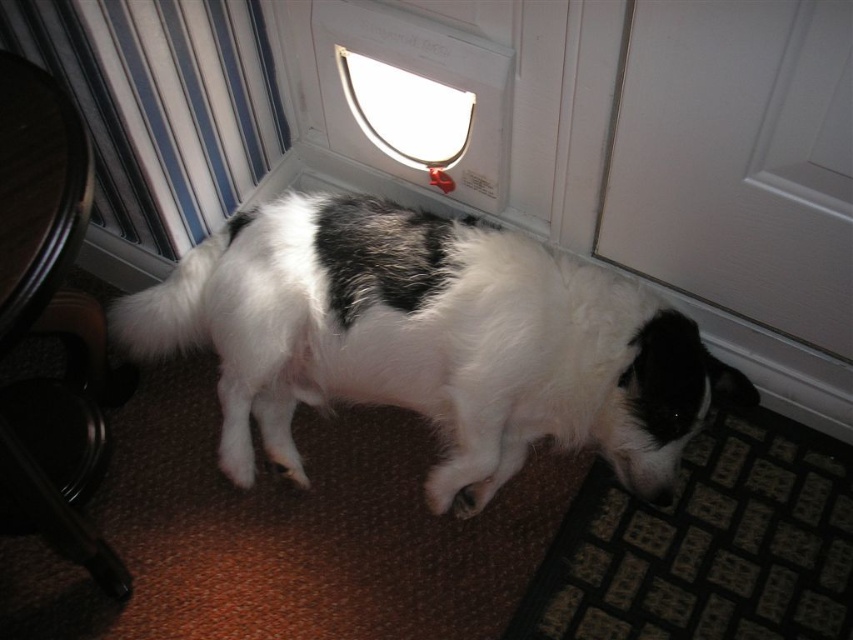
Which is above, white fluffy dog at center or transparent plastic pet door at upper center?

transparent plastic pet door at upper center is higher up.

The width and height of the screenshot is (853, 640). Describe the element at coordinates (428, 340) in the screenshot. I see `white fluffy dog at center` at that location.

Where is `white fluffy dog at center`? The width and height of the screenshot is (853, 640). white fluffy dog at center is located at coordinates (428, 340).

Who is taller, white fluffy dog at center or white matte door at lower right?

white fluffy dog at center

Based on the photo, who is more forward, [630,412] or [705,195]?

Point [705,195] is more forward.

Identify the location of white fluffy dog at center. (428, 340).

From the picture: Can you confirm if white matte door at lower right is thinner than transparent plastic pet door at upper center?

No, white matte door at lower right is not thinner than transparent plastic pet door at upper center.

Is point (722, 115) positioned in front of point (442, 99)?

Yes, it is in front of point (442, 99).

This screenshot has width=853, height=640. What do you see at coordinates (738, 160) in the screenshot? I see `white matte door at lower right` at bounding box center [738, 160].

Find the location of a particular element. white matte door at lower right is located at coordinates (738, 160).